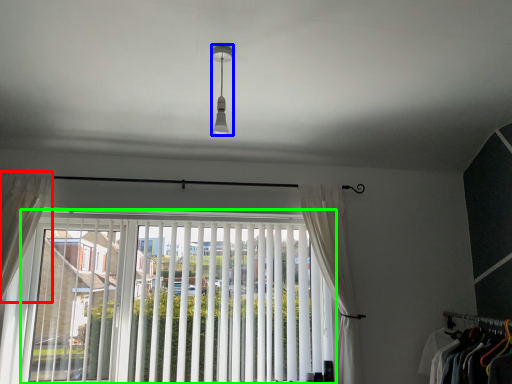
Question: Which object is the farthest from curtain (highlighted by a red box)? Choose among these: light fixture (highlighted by a blue box) or window (highlighted by a green box).

Choices:
 (A) light fixture
 (B) window

Answer: (A)